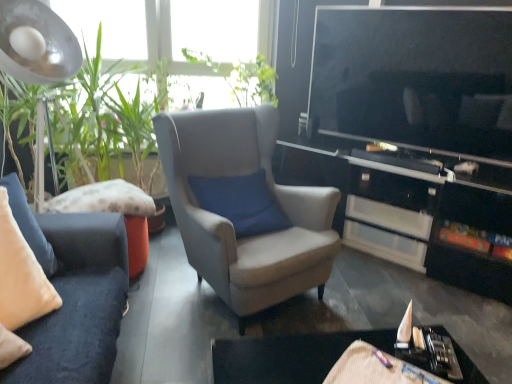
Question: Considering the relative sizes of green leafy plant at upper center and black glossy cabinet at center in the image provided, is green leafy plant at upper center thinner than black glossy cabinet at center?

Choices:
 (A) no
 (B) yes

Answer: (A)

Question: From a real-world perspective, is green leafy plant at upper center on top of black glossy cabinet at center?

Choices:
 (A) yes
 (B) no

Answer: (A)

Question: Does green leafy plant at upper center have a smaller size compared to black glossy cabinet at center?

Choices:
 (A) no
 (B) yes

Answer: (B)

Question: Are green leafy plant at upper center and black glossy cabinet at center located far from each other?

Choices:
 (A) no
 (B) yes

Answer: (B)

Question: Is green leafy plant at upper center at the left side of black glossy cabinet at center?

Choices:
 (A) no
 (B) yes

Answer: (B)

Question: Is green leafy plant at upper center looking in the opposite direction of black glossy cabinet at center?

Choices:
 (A) yes
 (B) no

Answer: (B)

Question: Considering the relative positions of black glossy cabinet at center and green leafy plant at upper center in the image provided, is black glossy cabinet at center behind green leafy plant at upper center?

Choices:
 (A) yes
 (B) no

Answer: (B)

Question: Is black glossy cabinet at center shorter than green leafy plant at upper center?

Choices:
 (A) no
 (B) yes

Answer: (B)

Question: Is black glossy cabinet at center bigger than green leafy plant at upper center?

Choices:
 (A) no
 (B) yes

Answer: (B)

Question: Is black glossy cabinet at center beside green leafy plant at upper center?

Choices:
 (A) no
 (B) yes

Answer: (A)

Question: From the image's perspective, would you say black glossy cabinet at center is shown under green leafy plant at upper center?

Choices:
 (A) no
 (B) yes

Answer: (B)

Question: Does black glossy cabinet at center appear on the left side of green leafy plant at upper center?

Choices:
 (A) no
 (B) yes

Answer: (A)

Question: Is green leafy plant at left closer to camera compared to velvet beige pillow at left?

Choices:
 (A) no
 (B) yes

Answer: (A)